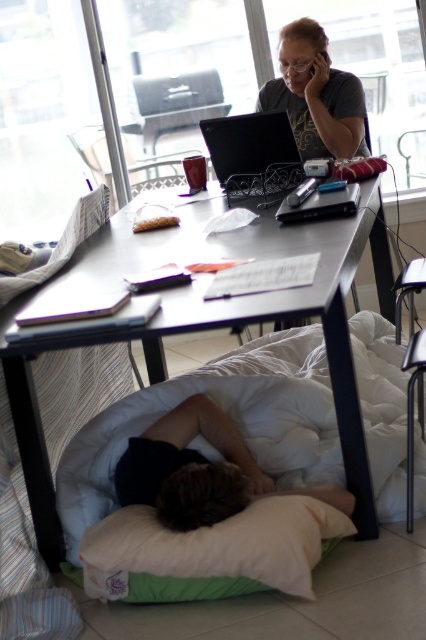
Question: Which object is positioned closest to the dark brown hair at lower center?

Choices:
 (A) black plastic phone at upper center
 (B) green fabric pillow at lower center
 (C) matte black laptop at upper center
 (D) white soft bed at lower center

Answer: (B)

Question: Is white soft bed at lower center to the right of green fabric pillow at lower center from the viewer's perspective?

Choices:
 (A) no
 (B) yes

Answer: (B)

Question: Which point is closer to the camera taking this photo?

Choices:
 (A) (109, 536)
 (B) (193, 230)
 (C) (236, 582)
 (D) (218, 500)

Answer: (D)

Question: Can you confirm if matte black laptop at upper center is bigger than black plastic phone at upper center?

Choices:
 (A) no
 (B) yes

Answer: (B)

Question: Is white soft bed at lower center above black plastic phone at upper center?

Choices:
 (A) no
 (B) yes

Answer: (A)

Question: Which point appears closest to the camera in this image?

Choices:
 (A) (307, 67)
 (B) (270, 236)
 (C) (354, 500)
 (D) (100, 460)

Answer: (C)